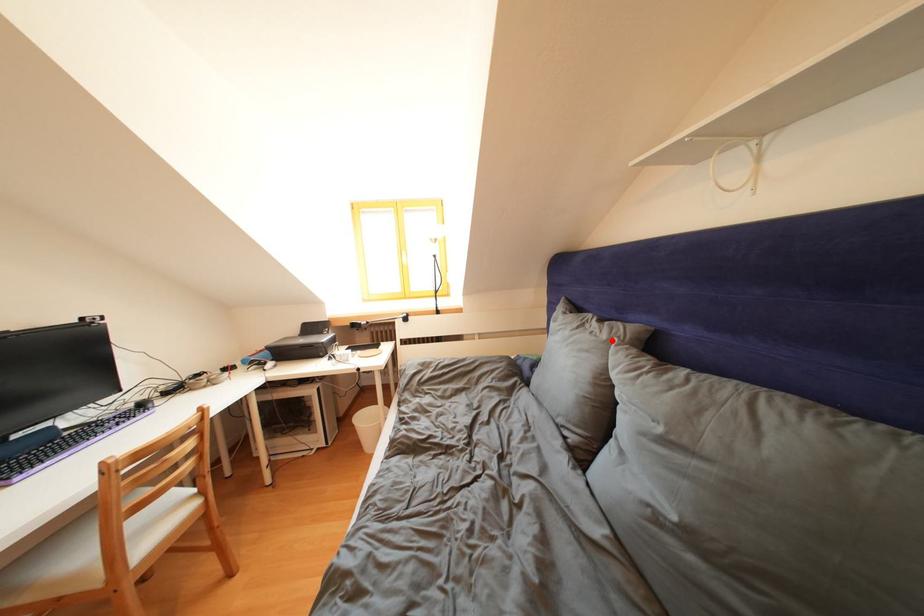
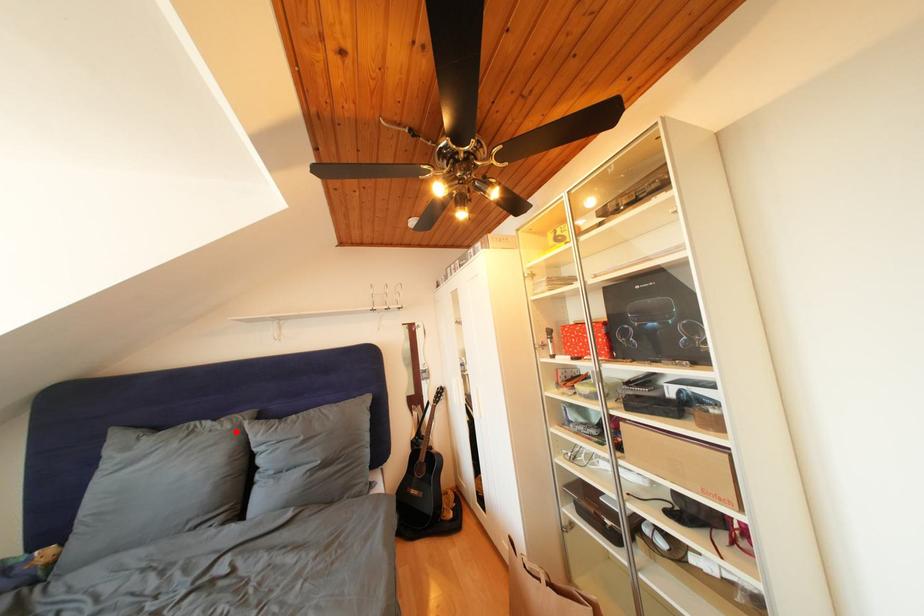
I am providing you with two images of the same scene from different viewpoints. A red point is marked on the first image and another point is marked on the second image. Is the red point in image1 aligned with the point shown in image2?

Yes